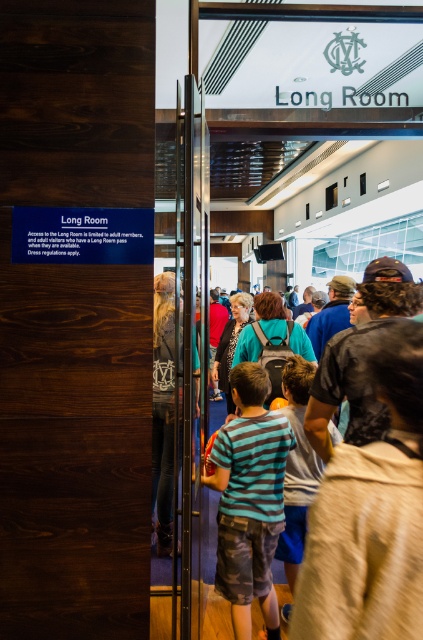
Question: Which of the following is the closest to the observer?

Choices:
 (A) (329, 547)
 (B) (222, 387)
 (C) (282, 321)
 (D) (158, 368)

Answer: (A)

Question: Does denim jeans at center appear on the left side of matte blue backpack at center?

Choices:
 (A) no
 (B) yes

Answer: (B)

Question: Does striped cotton shirt at center have a greater width compared to teal fabric jacket at center?

Choices:
 (A) yes
 (B) no

Answer: (B)

Question: Can you confirm if striped cotton shirt at center is positioned above matte blue backpack at center?

Choices:
 (A) no
 (B) yes

Answer: (A)

Question: Considering the real-world distances, which object is closest to the matte blue backpack at center?

Choices:
 (A) teal fabric jacket at center
 (B) striped cotton shirt at center

Answer: (A)

Question: Estimate the real-world distances between objects in this image. Which object is closer to the denim jeans at center?

Choices:
 (A) teal fabric jacket at center
 (B) matte blue backpack at center

Answer: (B)